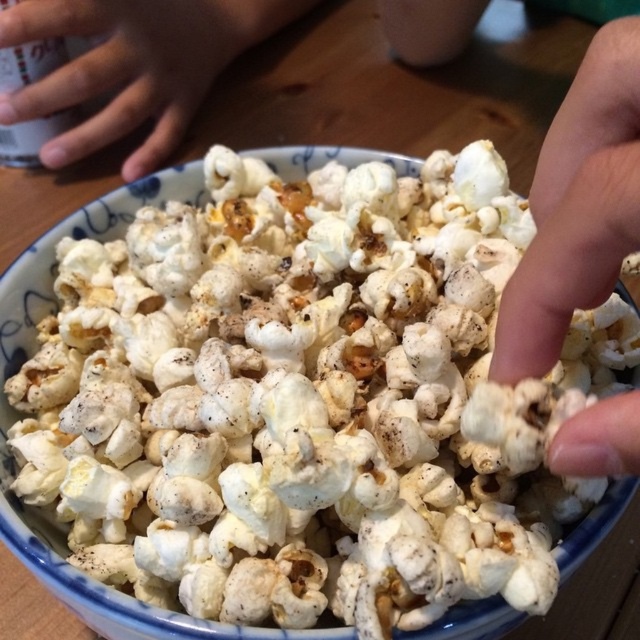
Question: Observing the image, what is the correct spatial positioning of flesh-toned skin at upper right in reference to skinny human hand at upper left?

Choices:
 (A) below
 (B) above

Answer: (A)

Question: Which of the following is the farthest from the observer?

Choices:
 (A) (177, 100)
 (B) (528, 332)

Answer: (A)

Question: Considering the relative positions of flesh-toned skin at upper right and skinny human hand at upper left in the image provided, where is flesh-toned skin at upper right located with respect to skinny human hand at upper left?

Choices:
 (A) right
 (B) left

Answer: (A)

Question: Which object appears closest to the camera in this image?

Choices:
 (A) skinny human hand at upper left
 (B) flesh-toned skin at upper right

Answer: (B)

Question: From the image, what is the correct spatial relationship of flesh-toned skin at upper right in relation to skinny human hand at upper left?

Choices:
 (A) right
 (B) left

Answer: (A)